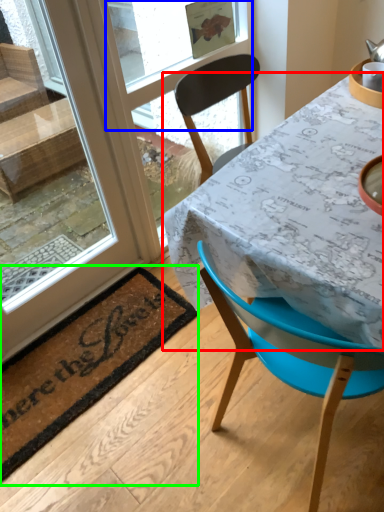
Question: Which is nearer to the table (highlighted by a red box)? window screen (highlighted by a blue box) or mat (highlighted by a green box).

Choices:
 (A) window screen
 (B) mat

Answer: (B)